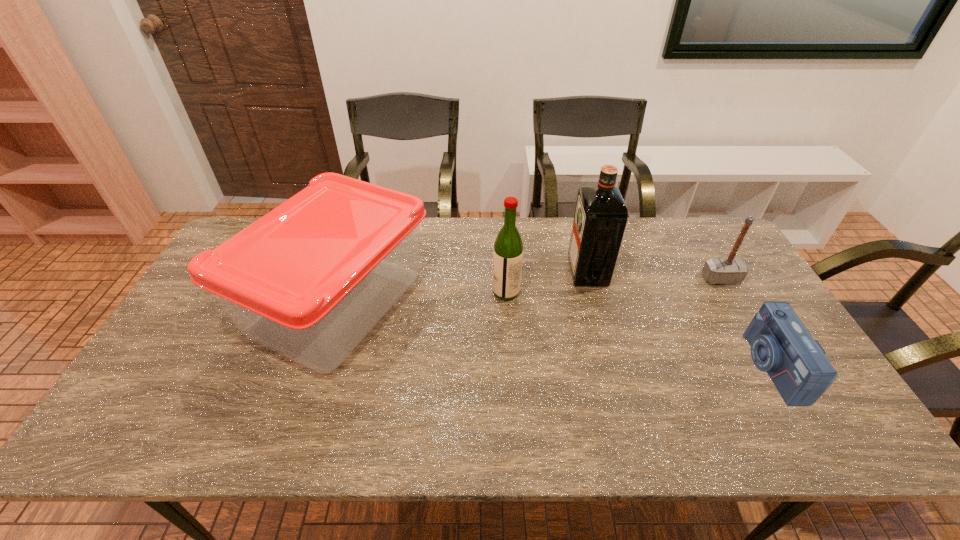
This screenshot has width=960, height=540. Find the location of `vacant area between the hammer and the second object from left to right`. vacant area between the hammer and the second object from left to right is located at coordinates (613, 285).

The width and height of the screenshot is (960, 540). I want to click on empty space that is in between the tray and the second shortest object, so click(529, 291).

The width and height of the screenshot is (960, 540). In order to click on empty location between the second object from left to right and the fourth tallest object in this screenshot , I will do `click(613, 285)`.

This screenshot has width=960, height=540. In order to click on unoccupied area between the third object from right to left and the left liquor in this screenshot , I will do `click(547, 282)`.

Image resolution: width=960 pixels, height=540 pixels. What are the coordinates of `free spot between the tray and the shortest object` in the screenshot? It's located at coord(554,334).

I want to click on object that ranks as the fourth closest to the camera, so click(310, 279).

The image size is (960, 540). Identify the location of object identified as the third closest to the camera. coord(508,248).

In order to click on vacant position in the image that satisfies the following two spatial constraints: 1. on the striking surface of the hammer; 2. on the label of the fourth object from right to left in this screenshot , I will do `click(728, 292)`.